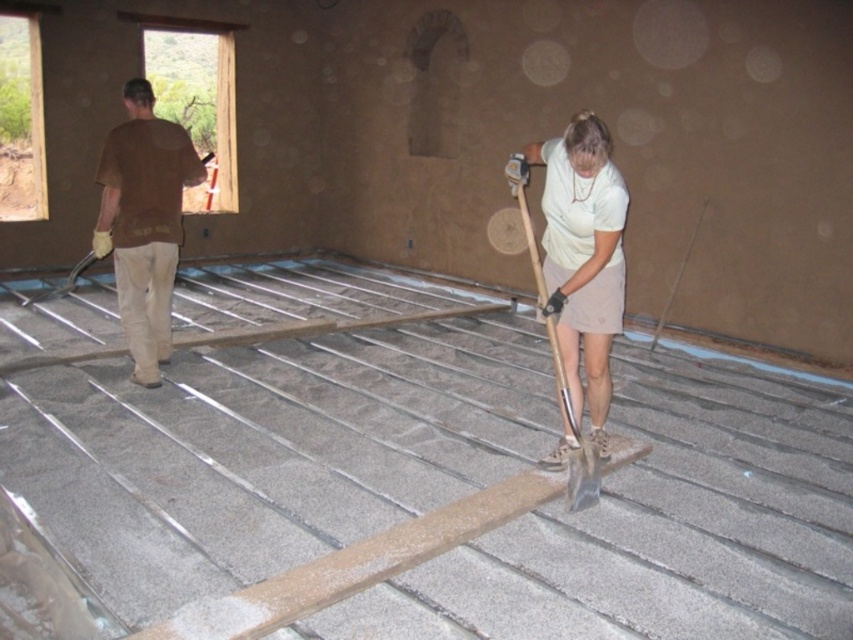
Is brown cotton shirt at left shorter than metallic silver shovel at center?

No, brown cotton shirt at left is not shorter than metallic silver shovel at center.

Which is below, brown cotton shirt at left or metallic silver shovel at center?

metallic silver shovel at center is below.

Which is behind, point (148, 152) or point (535, 266)?

The point (148, 152) is behind.

The image size is (853, 640). I want to click on brown cotton shirt at left, so click(144, 221).